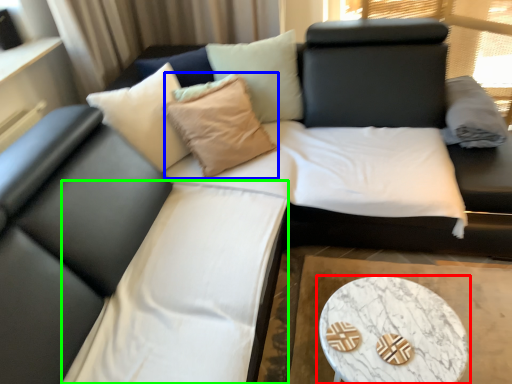
Question: Which object is the closest to the coffee table (highlighted by a red box)? Choose among these: throw pillow (highlighted by a blue box) or bedding (highlighted by a green box).

Choices:
 (A) throw pillow
 (B) bedding

Answer: (B)